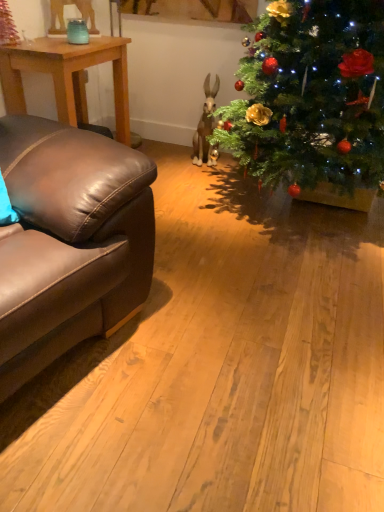
Question: Is light brown wooden table at left behind brown leather couch at left?

Choices:
 (A) yes
 (B) no

Answer: (A)

Question: Does light brown wooden table at left have a lesser height compared to brown leather couch at left?

Choices:
 (A) no
 (B) yes

Answer: (B)

Question: Is light brown wooden table at left taller than brown leather couch at left?

Choices:
 (A) yes
 (B) no

Answer: (B)

Question: Is light brown wooden table at left not near brown leather couch at left?

Choices:
 (A) no
 (B) yes

Answer: (B)

Question: Is light brown wooden table at left next to brown leather couch at left and touching it?

Choices:
 (A) yes
 (B) no

Answer: (B)

Question: Can you confirm if light brown wooden table at left is positioned to the right of brown leather couch at left?

Choices:
 (A) no
 (B) yes

Answer: (A)

Question: Is brown leather couch at left oriented towards light brown wooden table at left?

Choices:
 (A) no
 (B) yes

Answer: (A)

Question: Is brown leather couch at left smaller than light brown wooden table at left?

Choices:
 (A) yes
 (B) no

Answer: (B)

Question: Is brown leather couch at left behind light brown wooden table at left?

Choices:
 (A) no
 (B) yes

Answer: (A)

Question: Is brown leather couch at left thinner than light brown wooden table at left?

Choices:
 (A) yes
 (B) no

Answer: (B)

Question: From the image's perspective, is brown leather couch at left above light brown wooden table at left?

Choices:
 (A) yes
 (B) no

Answer: (B)

Question: Considering the relative sizes of brown leather couch at left and light brown wooden table at left in the image provided, is brown leather couch at left wider than light brown wooden table at left?

Choices:
 (A) no
 (B) yes

Answer: (B)

Question: Is brown leather couch at left inside or outside of light brown wooden table at left?

Choices:
 (A) inside
 (B) outside

Answer: (B)